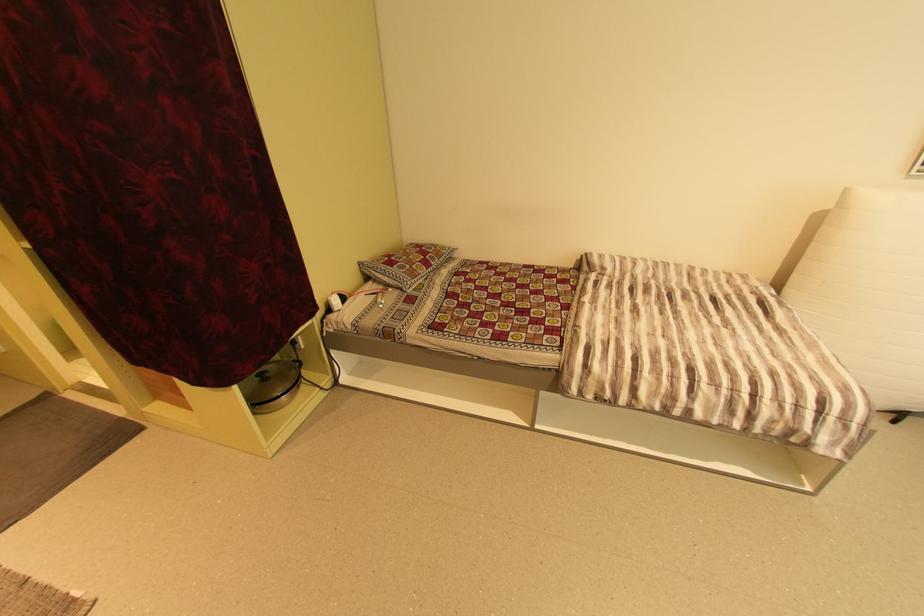
The height and width of the screenshot is (616, 924). I want to click on patterned pillow, so click(x=407, y=264).